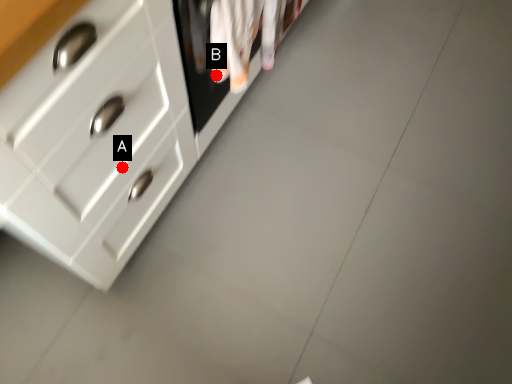
Question: Two points are circled on the image, labeled by A and B beside each circle. Which point appears farthest from the camera in this image?

Choices:
 (A) A is further
 (B) B is further

Answer: (B)